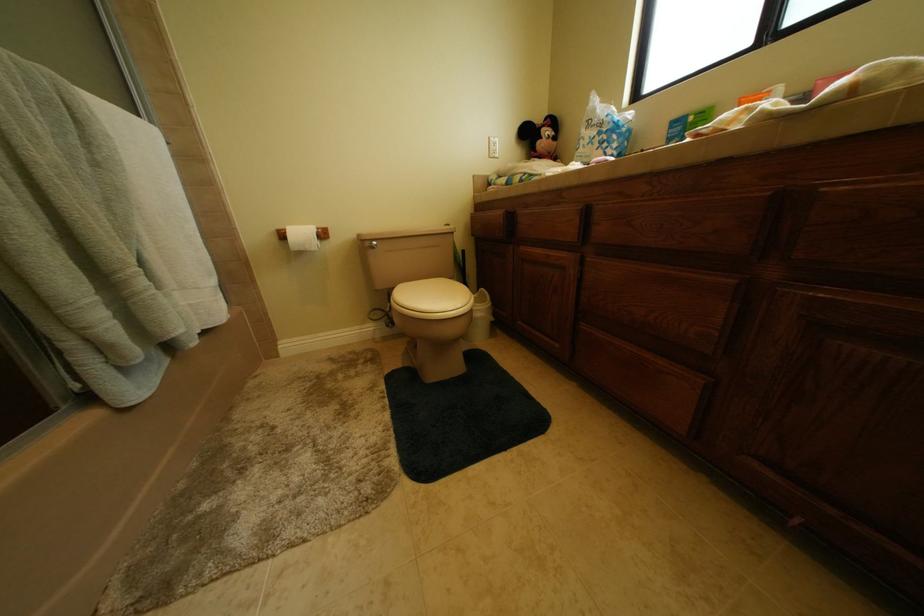
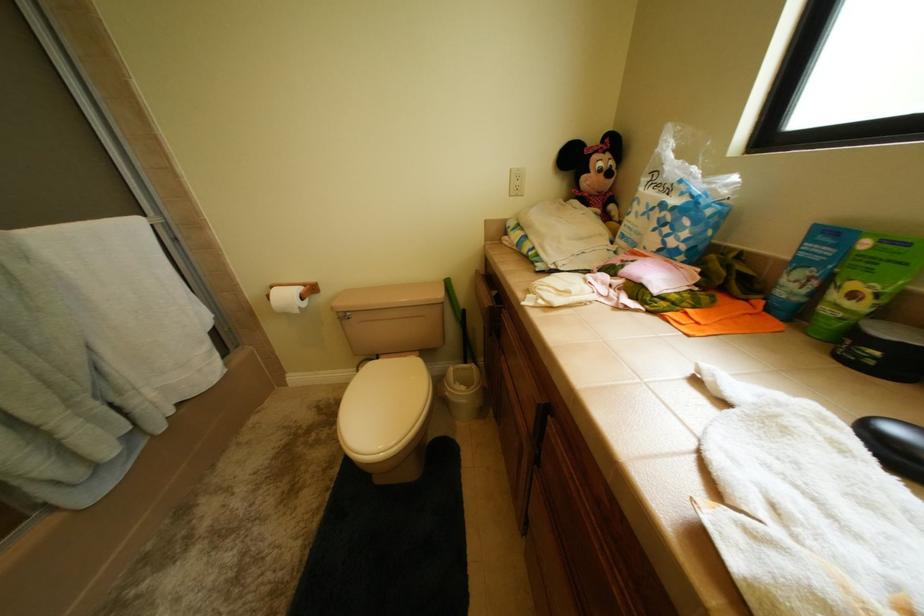
Question: The first image is from the beginning of the video and the second image is from the end. How did the camera likely rotate when shooting the video?

Choices:
 (A) Left
 (B) Right
 (C) Up
 (D) Down

Answer: (A)